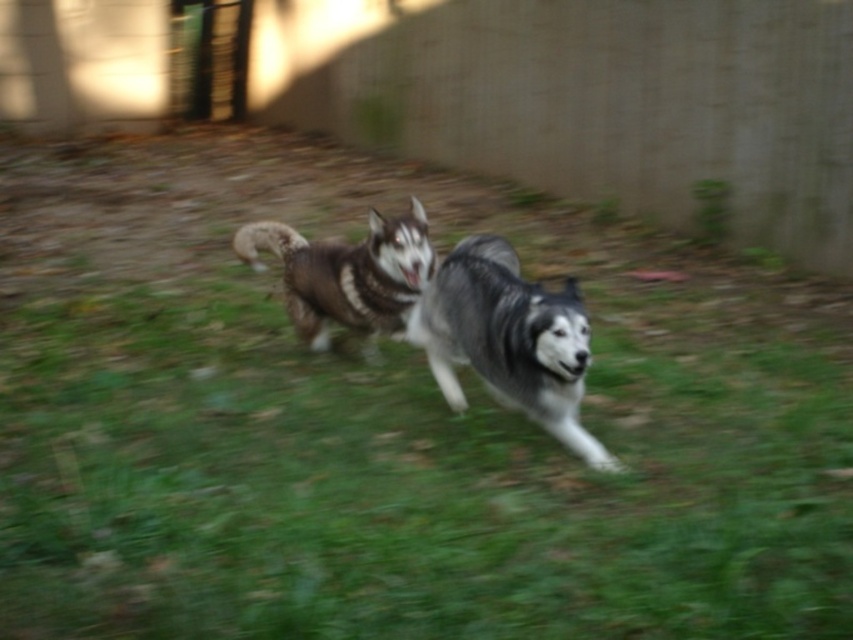
Who is lower down, green grass at center or gray-black fur dog at center?

Positioned lower is green grass at center.

Who is shorter, green grass at center or gray-black fur dog at center?

With less height is gray-black fur dog at center.

Between point (36, 508) and point (502, 342), which one is positioned in front?

Point (36, 508)

What are the coordinates of `green grass at center` in the screenshot? It's located at (416, 474).

At what (x,y) coordinates should I click in order to perform the action: click on gray-black fur dog at center. Please return your answer as a coordinate pair (x, y). Looking at the image, I should click on (509, 339).

You are a GUI agent. You are given a task and a screenshot of the screen. Output one action in this format:
    pyautogui.click(x=<x>, y=<y>)
    Task: Click on the gray-black fur dog at center
    
    Given the screenshot: What is the action you would take?
    pyautogui.click(x=509, y=339)

Is green grass at center shorter than brown fur husky at center?

In fact, green grass at center may be taller than brown fur husky at center.

Between green grass at center and brown fur husky at center, which one appears on the right side from the viewer's perspective?

green grass at center is more to the right.

Locate an element on the screen. green grass at center is located at coordinates (416, 474).

Where is `green grass at center`? This screenshot has height=640, width=853. green grass at center is located at coordinates (416, 474).